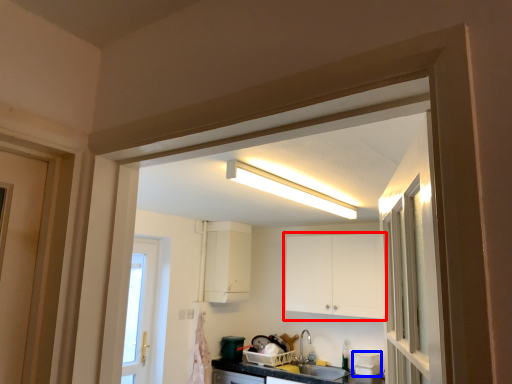
Question: Which of the following is the farthest to the observer, cabinetry (highlighted by a red box) or appliance (highlighted by a blue box)?

Choices:
 (A) cabinetry
 (B) appliance

Answer: (B)